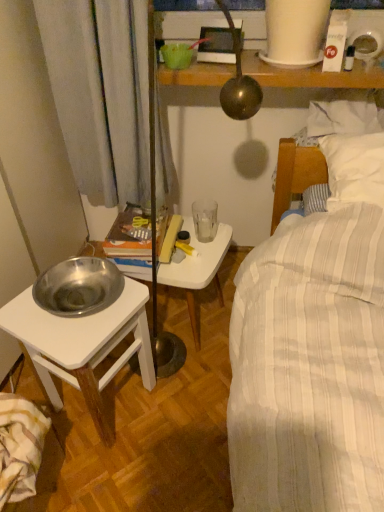
Identify the location of vacant region under silver metallic bowl at left (from a real-world perspective). The image size is (384, 512). coord(117,403).